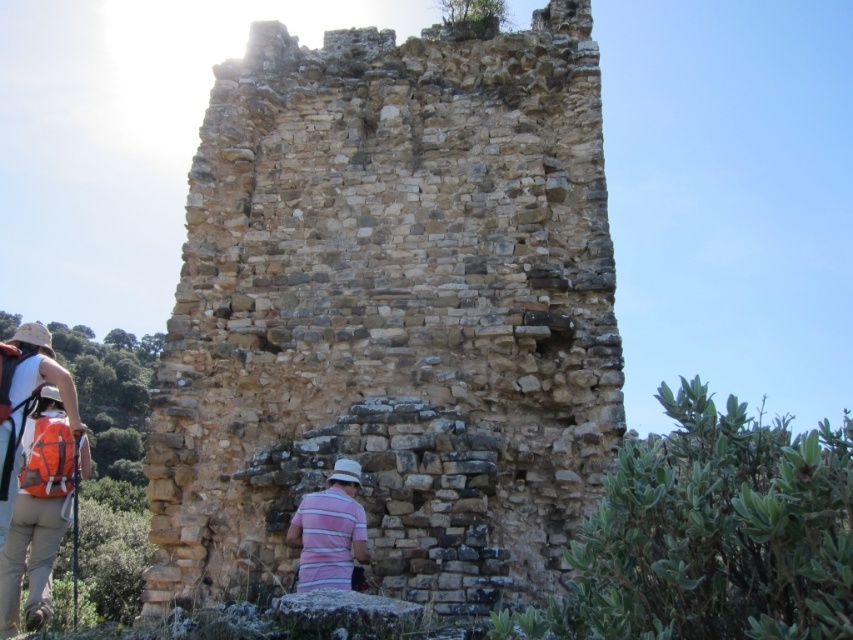
Question: Which of the following is the farthest from the observer?

Choices:
 (A) (296, 403)
 (B) (26, 612)
 (C) (347, 556)

Answer: (A)

Question: Which of the following is the closest to the observer?

Choices:
 (A) brown stone ruins at center
 (B) pink striped shirt at center
 (C) striped cotton shirt at lower left

Answer: (C)

Question: Can you confirm if striped cotton shirt at lower left is smaller than pink striped shirt at center?

Choices:
 (A) no
 (B) yes

Answer: (A)

Question: Does striped cotton shirt at lower left have a greater width compared to pink striped shirt at center?

Choices:
 (A) yes
 (B) no

Answer: (A)

Question: Which of the following is the closest to the observer?

Choices:
 (A) (48, 410)
 (B) (186, 400)

Answer: (A)

Question: Is brown stone ruins at center smaller than pink striped shirt at center?

Choices:
 (A) yes
 (B) no

Answer: (B)